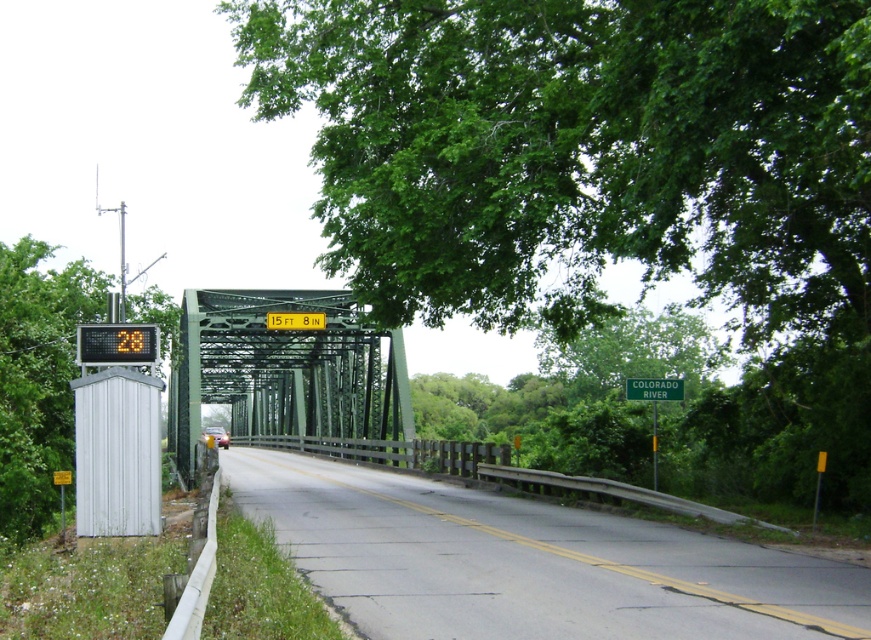
Question: Observing the image, what is the correct spatial positioning of asphalt road at center in reference to yellow metallic sign at center?

Choices:
 (A) above
 (B) below

Answer: (B)

Question: Does green leafy tree at center appear under green plastic sign at upper center?

Choices:
 (A) yes
 (B) no

Answer: (B)

Question: Which of the following is the closest to the observer?

Choices:
 (A) green plastic sign at upper center
 (B) orange digital sign at left
 (C) green leafy tree at left
 (D) green leafy tree at center

Answer: (D)

Question: Based on their relative distances, which object is farther from the green plastic sign at upper center?

Choices:
 (A) green metallic sign at right
 (B) orange digital sign at left
 (C) green metallic bridge at center

Answer: (C)

Question: Does green metallic bridge at center come in front of yellow metallic sign at center?

Choices:
 (A) no
 (B) yes

Answer: (B)

Question: Which of the following is the farthest from the observer?

Choices:
 (A) (346, 372)
 (B) (107, 344)
 (C) (358, 477)
 (D) (360, 100)

Answer: (A)